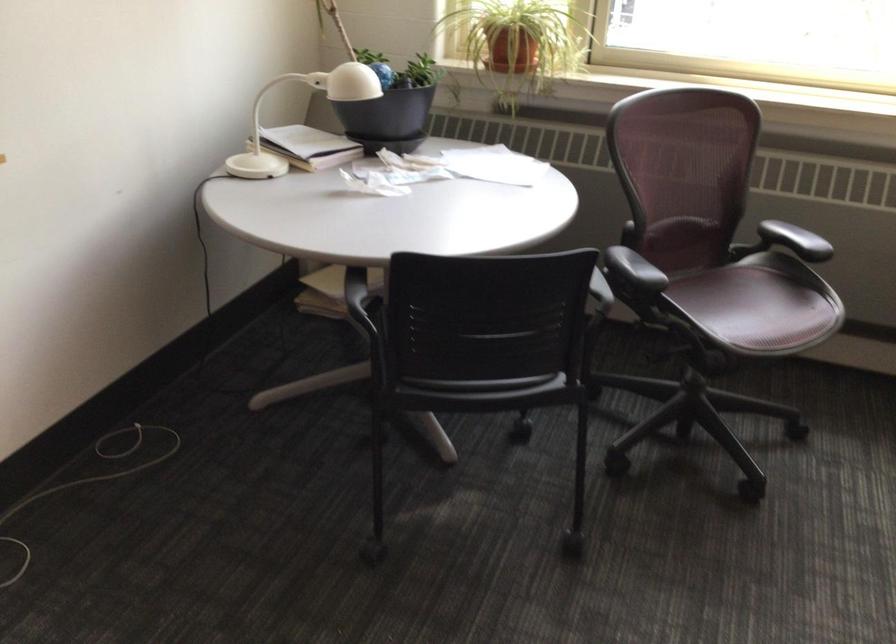
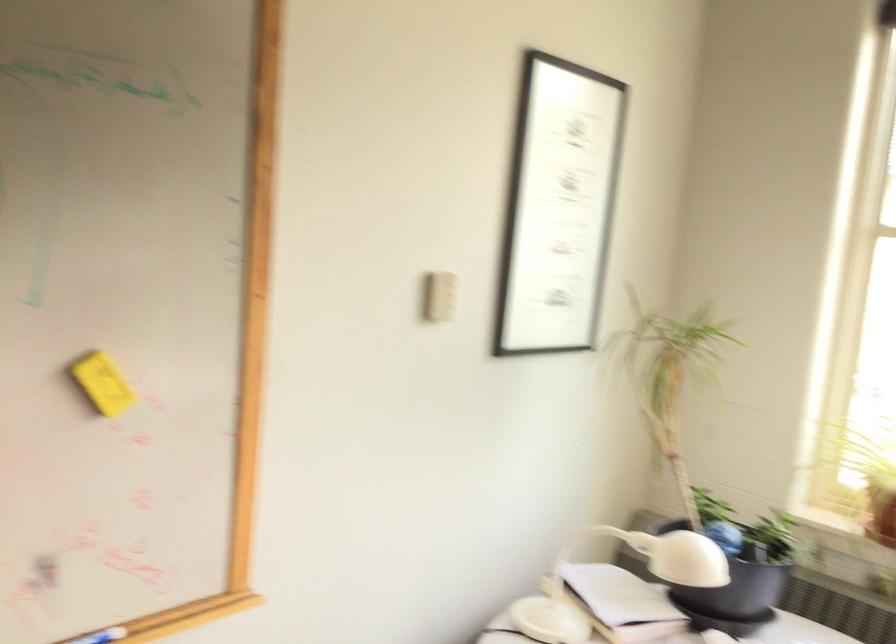
First-person continuous shooting, in which direction is the camera rotating?

The rotation direction of the camera is left-up.